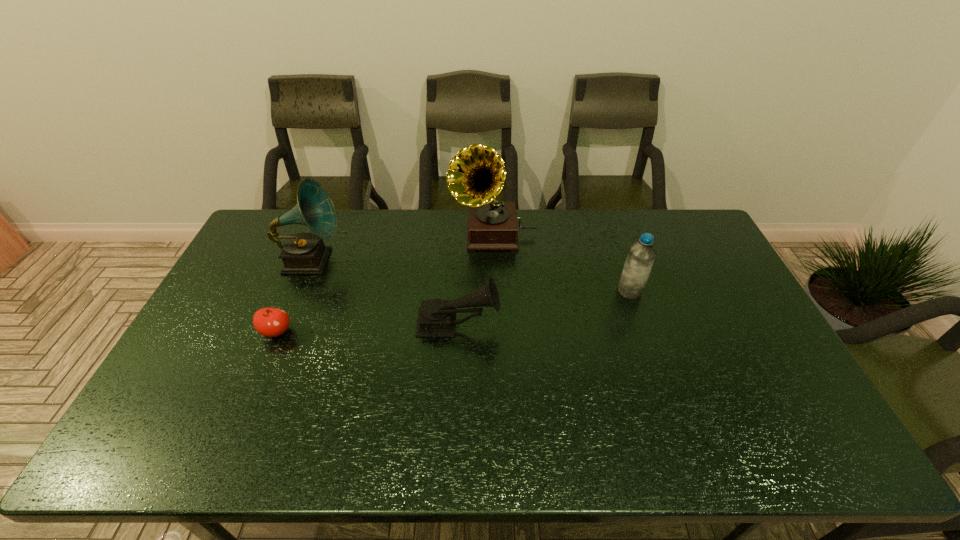
Locate an element on the screen. free spot between the shortest object and the leftmost phonograph_record is located at coordinates (294, 296).

Locate an element on the screen. This screenshot has width=960, height=540. empty location between the shortest object and the leftmost phonograph_record is located at coordinates (294, 296).

The height and width of the screenshot is (540, 960). Find the location of `object that stands as the fourth closest to the apple`. object that stands as the fourth closest to the apple is located at coordinates (641, 255).

Locate which object is the second closest to the shortest object. Please provide its 2D coordinates. Your answer should be formatted as a tuple, i.e. [(x, y)], where the tuple contains the x and y coordinates of a point satisfying the conditions above.

[(436, 318)]

Identify which phonograph_record is the second nearest to the apple. Please provide its 2D coordinates. Your answer should be formatted as a tuple, i.e. [(x, y)], where the tuple contains the x and y coordinates of a point satisfying the conditions above.

[(436, 318)]

Select which phonograph_record is the third closest to the apple. Please provide its 2D coordinates. Your answer should be formatted as a tuple, i.e. [(x, y)], where the tuple contains the x and y coordinates of a point satisfying the conditions above.

[(476, 174)]

Identify the location of vacant area that satisfies the following two spatial constraints: 1. from the horn of the nearest phonograph_record; 2. on the front side of the shortest object. The image size is (960, 540). (458, 332).

Identify the location of free space that satisfies the following two spatial constraints: 1. on the back side of the water bottle; 2. from the horn of the leftmost phonograph_record. (619, 261).

The image size is (960, 540). Identify the location of blank space that satisfies the following two spatial constraints: 1. from the horn of the leftmost phonograph_record; 2. on the front side of the shortest object. (282, 332).